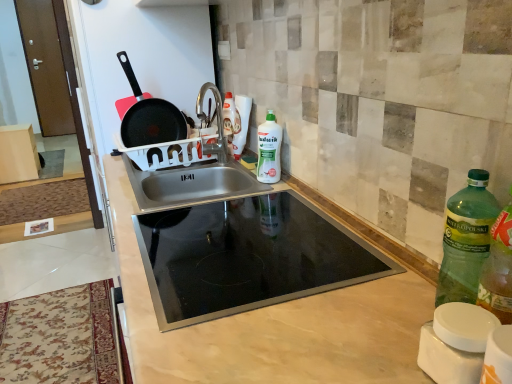
The width and height of the screenshot is (512, 384). What do you see at coordinates (269, 150) in the screenshot? I see `green matte bottle at center, arranged as the second bottle when ordered from the bottom` at bounding box center [269, 150].

Locate an element on the screen. The height and width of the screenshot is (384, 512). beige marble countertop at center is located at coordinates 272,326.

Image resolution: width=512 pixels, height=384 pixels. Find the location of `stainless steel sink at center`. stainless steel sink at center is located at coordinates tap(190, 184).

Considering the sizes of stainless steel sink at center and black non-stick frying pan at upper left in the image, is stainless steel sink at center taller or shorter than black non-stick frying pan at upper left?

stainless steel sink at center is shorter than black non-stick frying pan at upper left.

How many degrees apart are the facing directions of stainless steel sink at center and black non-stick frying pan at upper left?

94.6 degrees.

In the scene shown: Is stainless steel sink at center looking in the opposite direction of black non-stick frying pan at upper left?

No, black non-stick frying pan at upper left is not at the back of stainless steel sink at center.

From a real-world perspective, is stainless steel sink at center located higher than black non-stick frying pan at upper left?

No.

Considering the relative sizes of stainless steel sink at center and beige marble countertop at center in the image provided, is stainless steel sink at center thinner than beige marble countertop at center?

Correct, the width of stainless steel sink at center is less than that of beige marble countertop at center.

Is beige marble countertop at center located within stainless steel sink at center?

Definitely not — beige marble countertop at center is not inside stainless steel sink at center.

Which object is positioned more to the left, stainless steel sink at center or beige marble countertop at center?

Positioned to the left is stainless steel sink at center.

Is beige marble countertop at center bigger than green plastic bottle at right, marked as the 1th bottle in a bottom-to-top arrangement?

Indeed, beige marble countertop at center has a larger size compared to green plastic bottle at right, marked as the 1th bottle in a bottom-to-top arrangement.

Which is more to the left, beige marble countertop at center or green plastic bottle at right, which is counted as the 2th bottle, starting from the back?

Positioned to the left is beige marble countertop at center.

Is beige marble countertop at center located outside green plastic bottle at right, placed as the second bottle when sorted from left to right?

Yes, beige marble countertop at center is located beyond the bounds of green plastic bottle at right, placed as the second bottle when sorted from left to right.

Can you confirm if beige marble countertop at center is taller than green plastic bottle at right, acting as the 2th bottle starting from the top?

Correct, beige marble countertop at center is much taller as green plastic bottle at right, acting as the 2th bottle starting from the top.

Identify the location of countertop in front of the green matte bottle at center, positioned as the first bottle in back-to-front order. Image resolution: width=512 pixels, height=384 pixels. (272, 326).

Considering the relative positions of beige marble countertop at center and green matte bottle at center, marked as the 1th bottle in a top-to-bottom arrangement, in the image provided, is beige marble countertop at center to the left or to the right of green matte bottle at center, marked as the 1th bottle in a top-to-bottom arrangement,?

beige marble countertop at center is positioned on green matte bottle at center, marked as the 1th bottle in a top-to-bottom arrangement,'s left side.

From a real-world perspective, is beige marble countertop at center positioned under green matte bottle at center, marked as the 1th bottle in a top-to-bottom arrangement, based on gravity?

Yes, from a real-world perspective, beige marble countertop at center is beneath green matte bottle at center, marked as the 1th bottle in a top-to-bottom arrangement.

From the image's perspective, is beige marble countertop at center beneath black non-stick frying pan at upper left?

Yes, from the image's perspective, beige marble countertop at center is beneath black non-stick frying pan at upper left.

Considering their positions, is beige marble countertop at center located in front of or behind black non-stick frying pan at upper left?

beige marble countertop at center is positioned closer to the viewer than black non-stick frying pan at upper left.

Does point (191, 328) lie in front of point (132, 143)?

Yes, point (191, 328) is in front of point (132, 143).

Considering the positions of objects beige marble countertop at center and black non-stick frying pan at upper left in the image provided, who is more to the right, beige marble countertop at center or black non-stick frying pan at upper left?

beige marble countertop at center.

Is stainless steel sink at center inside or outside of green plastic bottle at right, positioned as the first bottle in front-to-back order?

stainless steel sink at center is not enclosed by green plastic bottle at right, positioned as the first bottle in front-to-back order.

Is stainless steel sink at center bigger than green plastic bottle at right, placed as the second bottle when sorted from left to right?

Yes.

From the image's perspective, is stainless steel sink at center under green plastic bottle at right, marked as the 1th bottle in a bottom-to-top arrangement?

Actually, stainless steel sink at center appears above green plastic bottle at right, marked as the 1th bottle in a bottom-to-top arrangement, in the image.

This screenshot has height=384, width=512. Find the location of `bottle that appears in front of the stainless steel sink at center`. bottle that appears in front of the stainless steel sink at center is located at coordinates coord(466,239).

Is green plastic bottle at right, positioned as the first bottle in front-to-back order, at the left side of black non-stick frying pan at upper left?

In fact, green plastic bottle at right, positioned as the first bottle in front-to-back order, is to the right of black non-stick frying pan at upper left.

From the image's perspective, is green plastic bottle at right, placed as the second bottle when sorted from left to right, below black non-stick frying pan at upper left?

Yes, from the image's perspective, green plastic bottle at right, placed as the second bottle when sorted from left to right, is below black non-stick frying pan at upper left.

Between green plastic bottle at right, which is counted as the 2th bottle, starting from the back, and black non-stick frying pan at upper left, which one has smaller size?

With smaller size is green plastic bottle at right, which is counted as the 2th bottle, starting from the back.

From a real-world perspective, between green plastic bottle at right, which is counted as the 2th bottle, starting from the back, and black non-stick frying pan at upper left, who is vertically higher?

In real-world perspective, black non-stick frying pan at upper left is above.

At what (x,y) coordinates should I click in order to perform the action: click on sink below the black non-stick frying pan at upper left (from a real-world perspective). Please return your answer as a coordinate pair (x, y). Looking at the image, I should click on (190, 184).

Locate an element on the screen. countertop below the stainless steel sink at center (from the image's perspective) is located at coordinates (272, 326).

From the image, which object appears to be nearer to green matte bottle at center, the 2th bottle viewed from the right, beige marble countertop at center or green plastic bottle at right, placed as the second bottle when sorted from left to right?

Based on the image, beige marble countertop at center appears to be nearer to green matte bottle at center, the 2th bottle viewed from the right.

Looking at the image, which one is located closer to stainless steel sink at center, green plastic bottle at right, which is counted as the 2th bottle, starting from the back, or beige marble countertop at center?

beige marble countertop at center is closer to stainless steel sink at center.

When comparing their distances from stainless steel sink at center, does green matte bottle at center, positioned as the first bottle in back-to-front order, or beige marble countertop at center seem further?

Based on the image, beige marble countertop at center appears to be further to stainless steel sink at center.

From the image, which object appears to be nearer to stainless steel sink at center, green plastic bottle at right, which is counted as the 2th bottle, starting from the back, or black non-stick frying pan at upper left?

black non-stick frying pan at upper left lies closer to stainless steel sink at center than the other object.

Looking at the image, which one is located further to beige marble countertop at center, black non-stick frying pan at upper left or green plastic bottle at right, the first bottle viewed from the right?

black non-stick frying pan at upper left lies further to beige marble countertop at center than the other object.

Estimate the real-world distances between objects in this image. Which object is further from green matte bottle at center, positioned as the first bottle in back-to-front order, black non-stick frying pan at upper left or stainless steel sink at center?

Based on the image, black non-stick frying pan at upper left appears to be further to green matte bottle at center, positioned as the first bottle in back-to-front order.

Looking at the image, which one is located further to beige marble countertop at center, green matte bottle at center, the 1th bottle viewed from the left, or stainless steel sink at center?

green matte bottle at center, the 1th bottle viewed from the left, is further to beige marble countertop at center.

Which object lies further to the anchor point beige marble countertop at center, green plastic bottle at right, positioned as the first bottle in front-to-back order, or black non-stick frying pan at upper left?

black non-stick frying pan at upper left is further to beige marble countertop at center.

Image resolution: width=512 pixels, height=384 pixels. What are the coordinates of `countertop positioned between green plastic bottle at right, acting as the 2th bottle starting from the top, and black non-stick frying pan at upper left from near to far` in the screenshot? It's located at (272, 326).

Find the location of a particular element. countertop positioned between green plastic bottle at right, acting as the 2th bottle starting from the top, and green matte bottle at center, the 1th bottle viewed from the left, from near to far is located at coordinates (272, 326).

Locate an element on the screen. The image size is (512, 384). sink located between beige marble countertop at center and green matte bottle at center, marked as the 1th bottle in a top-to-bottom arrangement, in the depth direction is located at coordinates (190, 184).

Locate an element on the screen. sink located between green plastic bottle at right, acting as the 2th bottle starting from the top, and green matte bottle at center, marked as the 1th bottle in a top-to-bottom arrangement, in the depth direction is located at coordinates (190, 184).